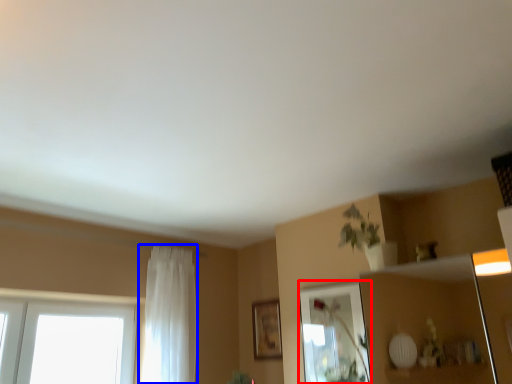
Question: Which object is further to the camera taking this photo, mirror (highlighted by a red box) or curtain (highlighted by a blue box)?

Choices:
 (A) mirror
 (B) curtain

Answer: (B)